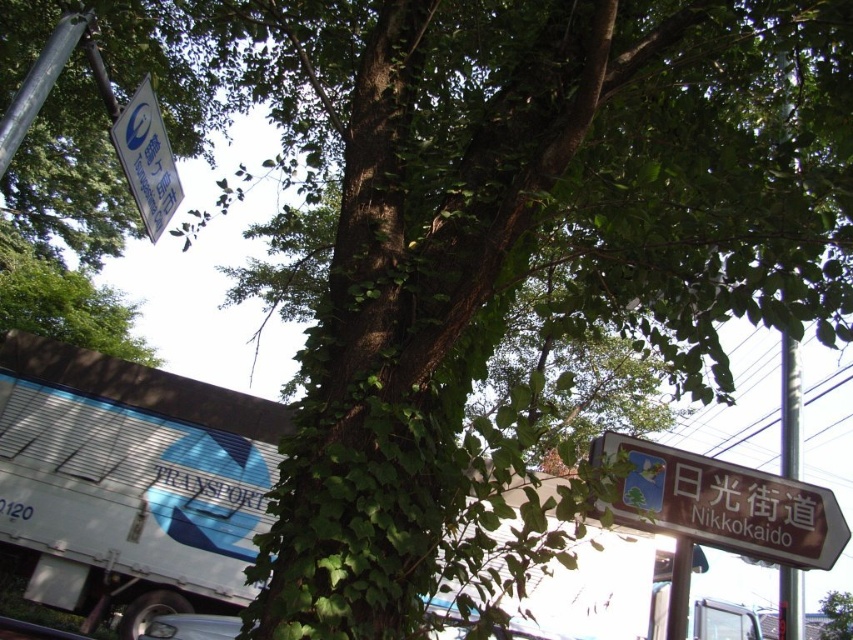
You are a tourist in Japan and see the white plastic sign at upper left and the brown wooden signpost at right. Which one is located to the left of the other?

The white plastic sign at upper left is positioned on the left side of brown wooden signpost at right.

From the picture: You are standing at the base of the large tree in the street scene. You need to walk to the brown wooden signpost at right but want to avoid the white plastic sign at upper left. Given that the distance between them is 5.74 meters, can you walk around the tree to reach the signpost without getting too close to the white plastic sign?

The white plastic sign at upper left is 5.74 meters away from the brown wooden signpost at right. Since you are at the base of the tree, you can walk around the tree to reach the brown wooden signpost at right while maintaining a safe distance from the white plastic sign at upper left.

You are driving a white metallic truck at lower left and need to pass through a narrow alley that is only as wide as the brown wooden sign at lower right. Can your truck fit through the alley?

The white metallic truck at lower left might be wider than the brown wooden sign at lower right, so there is a possibility that the truck cannot fit through the alley. It is recommended to check the truck dimensions before proceeding.